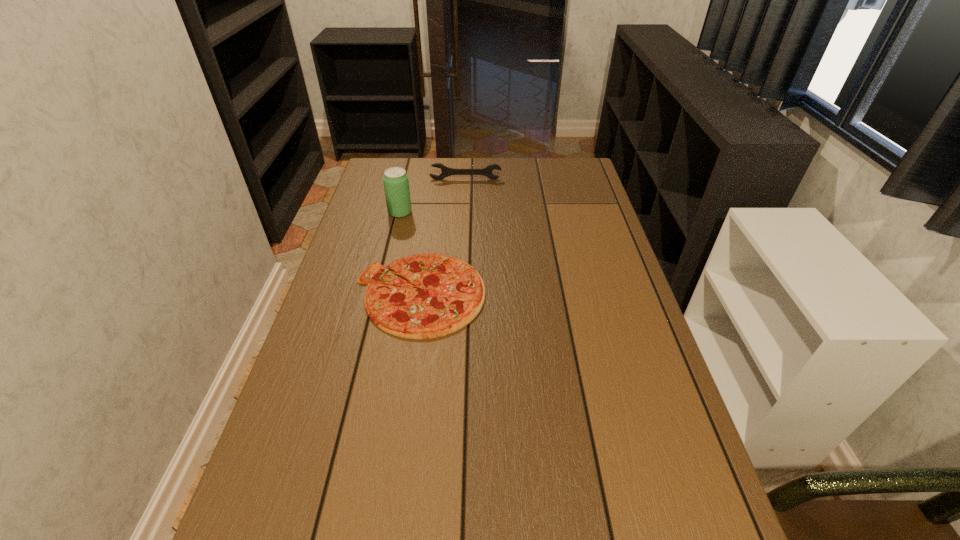
Locate an element on the screen. The height and width of the screenshot is (540, 960). vacant area that lies between the soda and the second tallest object is located at coordinates (433, 196).

What are the coordinates of `object that is the closest to the soda` in the screenshot? It's located at (445, 171).

Where is `object identified as the second closest to the nearest object`? The height and width of the screenshot is (540, 960). object identified as the second closest to the nearest object is located at coordinates (445, 171).